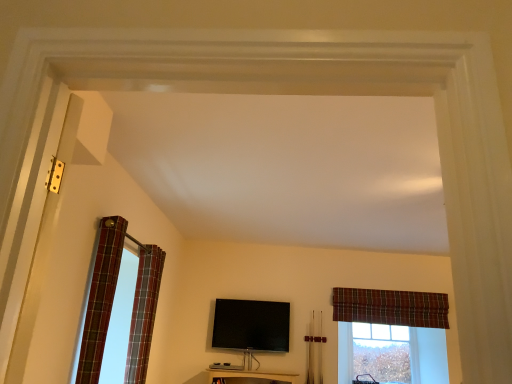
Question: From a real-world perspective, is plaid fabric curtain at upper right, which is the 3th curtain in front-to-back order, above or below black glossy flat-screen tv at center?

Choices:
 (A) below
 (B) above

Answer: (B)

Question: In the image, is plaid fabric curtain at upper right, the first curtain positioned from the back, on the left side or the right side of black glossy flat-screen tv at center?

Choices:
 (A) right
 (B) left

Answer: (A)

Question: Considering the real-world distances, which object is farthest from the plaid fabric curtain at upper right, which is the 3th curtain in front-to-back order?

Choices:
 (A) plaid fabric curtain at left, the 2th curtain from the front
 (B) plaid fabric curtain at left, the 3th curtain from the right
 (C) clear glass window at center
 (D) black glossy flat-screen tv at center

Answer: (B)

Question: Estimate the real-world distances between objects in this image. Which object is closer to the clear glass window at center?

Choices:
 (A) plaid fabric curtain at left, acting as the 1th curtain starting from the left
 (B) black glossy flat-screen tv at center
 (C) plaid fabric curtain at left, which is the 2th curtain in back-to-front order
 (D) plaid fabric curtain at upper right, which is the 3th curtain in front-to-back order

Answer: (D)